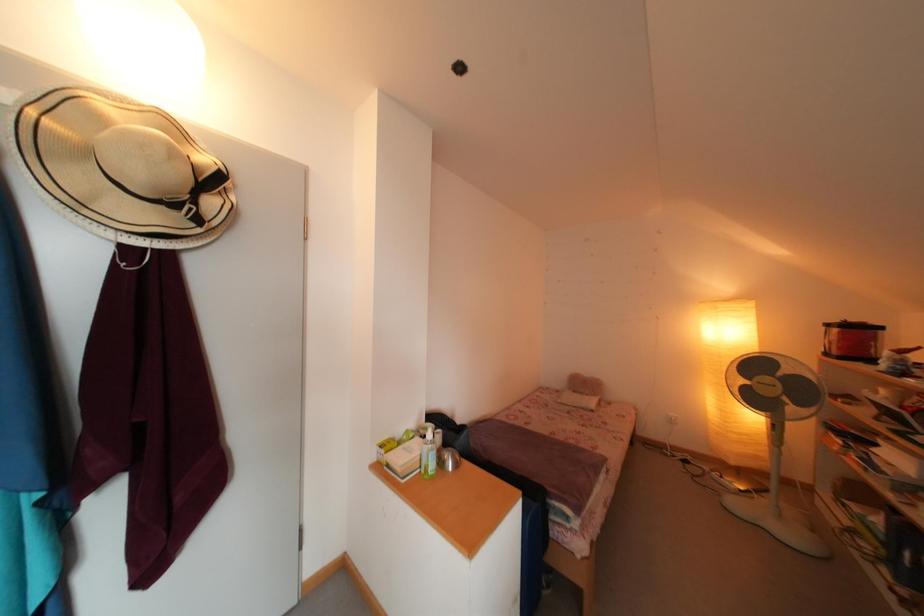
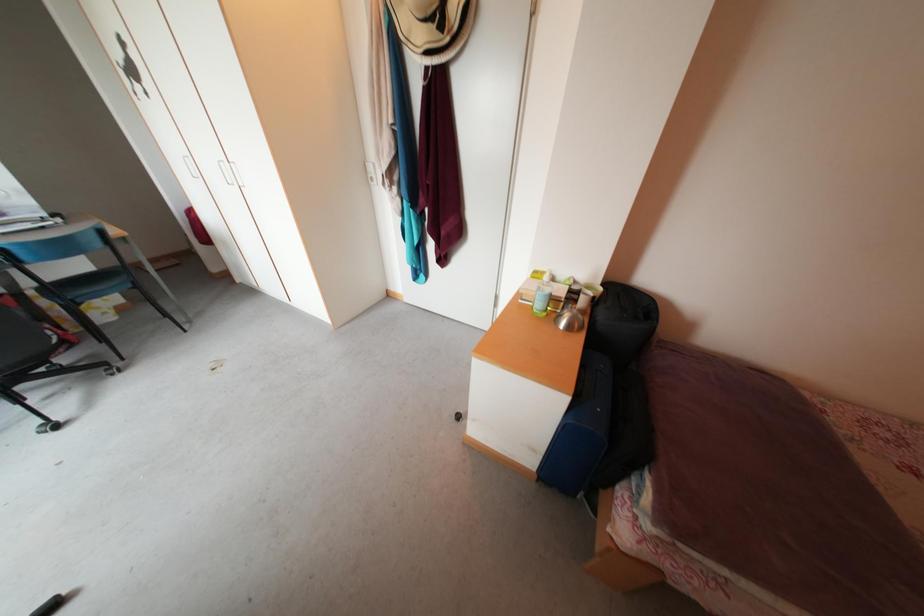
In the scene shown: First-person continuous shooting, in which direction is the camera rotating?

The camera's rotation is toward left-down.